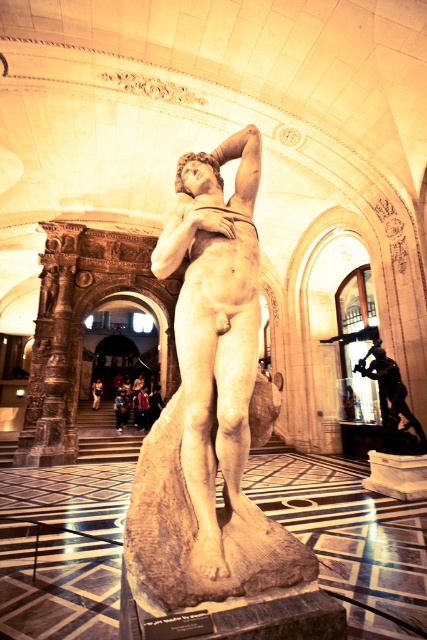
From the picture: Can you confirm if white marble statue at center is taller than shiny bronze statue at center?

Indeed, white marble statue at center has a greater height compared to shiny bronze statue at center.

Who is taller, white marble statue at center or shiny bronze statue at center?

With more height is white marble statue at center.

Who is more forward, (x=228, y=433) or (x=370, y=353)?

Point (x=228, y=433) is in front.

This screenshot has width=427, height=640. In order to click on white marble statue at center in this screenshot , I will do `click(210, 404)`.